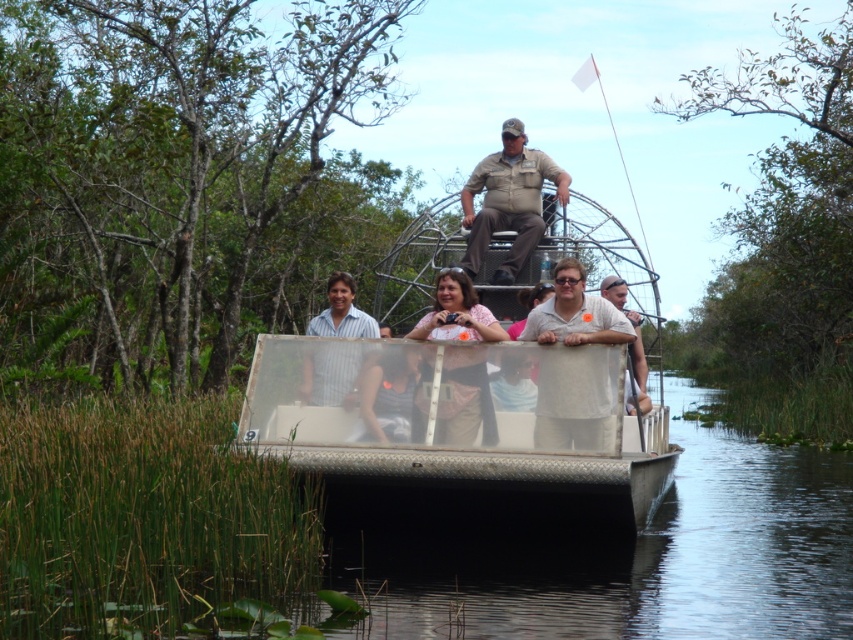
Does gray matte shirt at center have a lesser height compared to khaki uniform at center?

Yes.

Who is positioned more to the left, gray matte shirt at center or khaki uniform at center?

khaki uniform at center is more to the left.

Find the location of `gray matte shirt at center`. gray matte shirt at center is located at coordinates (573, 401).

Can you confirm if khaki uniform at center is taller than pink fabric purse at center?

Correct, khaki uniform at center is much taller as pink fabric purse at center.

Which is above, khaki uniform at center or pink fabric purse at center?

khaki uniform at center

Is point (503, 209) behind point (450, 289)?

Yes, point (503, 209) is farther from viewer.

The width and height of the screenshot is (853, 640). Identify the location of khaki uniform at center. (508, 200).

Can you confirm if pink fabric purse at center is bigger than striped cotton shirt at center?

Actually, pink fabric purse at center might be smaller than striped cotton shirt at center.

Can you confirm if pink fabric purse at center is shorter than striped cotton shirt at center?

No.

From the picture: Who is more forward, (457, 273) or (360, 333)?

Point (457, 273) is more forward.

Where is `pink fabric purse at center`? The height and width of the screenshot is (640, 853). pink fabric purse at center is located at coordinates (465, 401).